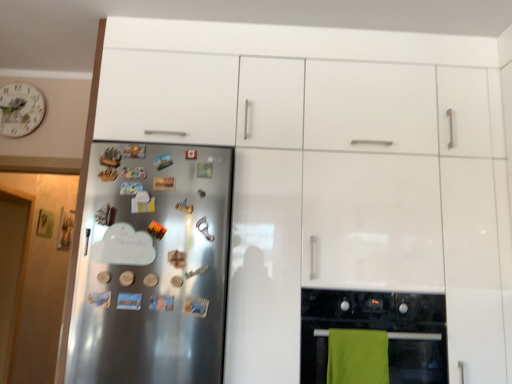
Based on the photo, measure the distance between satin silver fridge at left and camera.

satin silver fridge at left is 1.57 meters away from camera.

What are the coordinates of `satin silver fridge at left` in the screenshot? It's located at (152, 265).

Choose the correct answer: Is satin silver fridge at left inside white floral clock at upper left or outside it?

The correct answer is: outside.

Is satin silver fridge at left beside white floral clock at upper left?

No, satin silver fridge at left is not with white floral clock at upper left.

Which is more to the right, satin silver fridge at left or white floral clock at upper left?

From the viewer's perspective, satin silver fridge at left appears more on the right side.

Which of these two, green fabric towel at lower center or black glass oven at lower right, is bigger?

black glass oven at lower right is bigger.

Considering the relative sizes of green fabric towel at lower center and black glass oven at lower right in the image provided, is green fabric towel at lower center shorter than black glass oven at lower right?

Yes, green fabric towel at lower center is shorter than black glass oven at lower right.

Between green fabric towel at lower center and black glass oven at lower right, which one has smaller width?

green fabric towel at lower center.

How much distance is there between white floral clock at upper left and satin silver fridge at left?

white floral clock at upper left is 1.26 meters away from satin silver fridge at left.

Between white floral clock at upper left and satin silver fridge at left, which one is positioned in front?

satin silver fridge at left.

Looking at their sizes, would you say white floral clock at upper left is wider or thinner than satin silver fridge at left?

Considering their sizes, white floral clock at upper left looks slimmer than satin silver fridge at left.

Is white floral clock at upper left surrounding satin silver fridge at left?

That's incorrect, satin silver fridge at left is not inside white floral clock at upper left.

Is the position of white floral clock at upper left less distant than that of black glass oven at lower right?

No, white floral clock at upper left is further to the viewer.

Is white floral clock at upper left not inside black glass oven at lower right?

Yes, white floral clock at upper left is not within black glass oven at lower right.

From the image's perspective, between white floral clock at upper left and black glass oven at lower right, who is located below?

black glass oven at lower right is shown below in the image.

From the image's perspective, is satin silver fridge at left below black glass oven at lower right?

Actually, satin silver fridge at left appears above black glass oven at lower right in the image.

How many degrees apart are the facing directions of satin silver fridge at left and black glass oven at lower right?

The facing directions of satin silver fridge at left and black glass oven at lower right are 0.000208 degrees apart.

Is black glass oven at lower right surrounded by satin silver fridge at left?

Definitely not — black glass oven at lower right is not inside satin silver fridge at left.

Would you say green fabric towel at lower center is outside satin silver fridge at left?

Yes, green fabric towel at lower center is not within satin silver fridge at left.

Measure the distance from green fabric towel at lower center to satin silver fridge at left.

27.86 inches.

Is green fabric towel at lower center looking in the opposite direction of satin silver fridge at left?

No, green fabric towel at lower center's orientation is not away from satin silver fridge at left.

From a real-world perspective, is green fabric towel at lower center above or below satin silver fridge at left?

green fabric towel at lower center is situated lower than satin silver fridge at left in the real world.

In terms of height, does white floral clock at upper left look taller or shorter compared to green fabric towel at lower center?

In the image, white floral clock at upper left appears to be taller than green fabric towel at lower center.

Does white floral clock at upper left have a smaller size compared to green fabric towel at lower center?

Correct, white floral clock at upper left occupies less space than green fabric towel at lower center.

Locate an element on the screen. beach towel on the right of white floral clock at upper left is located at coordinates (357, 356).

Is white floral clock at upper left wider or thinner than green fabric towel at lower center?

In the image, white floral clock at upper left appears to be more narrow than green fabric towel at lower center.

I want to click on clock above the satin silver fridge at left (from the image's perspective), so click(x=20, y=109).

Locate an element on the screen. The height and width of the screenshot is (384, 512). home appliance on the right of the green fabric towel at lower center is located at coordinates (377, 329).

Which object lies further to the anchor point green fabric towel at lower center, black glass oven at lower right or white floral clock at upper left?

white floral clock at upper left lies further to green fabric towel at lower center than the other object.

Estimate the real-world distances between objects in this image. Which object is closer to white floral clock at upper left, black glass oven at lower right or satin silver fridge at left?

Among the two, satin silver fridge at left is located nearer to white floral clock at upper left.

From the image, which object appears to be farther from satin silver fridge at left, white floral clock at upper left or black glass oven at lower right?

white floral clock at upper left is positioned further to the anchor satin silver fridge at left.

Looking at the image, which one is located further to white floral clock at upper left, satin silver fridge at left or black glass oven at lower right?

The object further to white floral clock at upper left is black glass oven at lower right.

Looking at the image, which one is located closer to white floral clock at upper left, green fabric towel at lower center or satin silver fridge at left?

satin silver fridge at left lies closer to white floral clock at upper left than the other object.

Which object lies nearer to the anchor point black glass oven at lower right, green fabric towel at lower center or satin silver fridge at left?

Among the two, green fabric towel at lower center is located nearer to black glass oven at lower right.

From the image, which object appears to be farther from satin silver fridge at left, black glass oven at lower right or green fabric towel at lower center?

The object further to satin silver fridge at left is green fabric towel at lower center.

Considering their positions, is black glass oven at lower right positioned further to satin silver fridge at left than white floral clock at upper left?

white floral clock at upper left lies further to satin silver fridge at left than the other object.

You are a GUI agent. You are given a task and a screenshot of the screen. Output one action in this format:
    pyautogui.click(x=<x>, y=<y>)
    Task: Click on the refrigerator between white floral clock at upper left and black glass oven at lower right from left to right
    The width and height of the screenshot is (512, 384).
    Given the screenshot: What is the action you would take?
    pyautogui.click(x=152, y=265)

The image size is (512, 384). I want to click on beach towel between white floral clock at upper left and black glass oven at lower right from left to right, so click(357, 356).

Identify the location of beach towel between satin silver fridge at left and black glass oven at lower right from left to right. [357, 356].

Identify the location of refrigerator situated between white floral clock at upper left and green fabric towel at lower center from left to right. point(152,265).